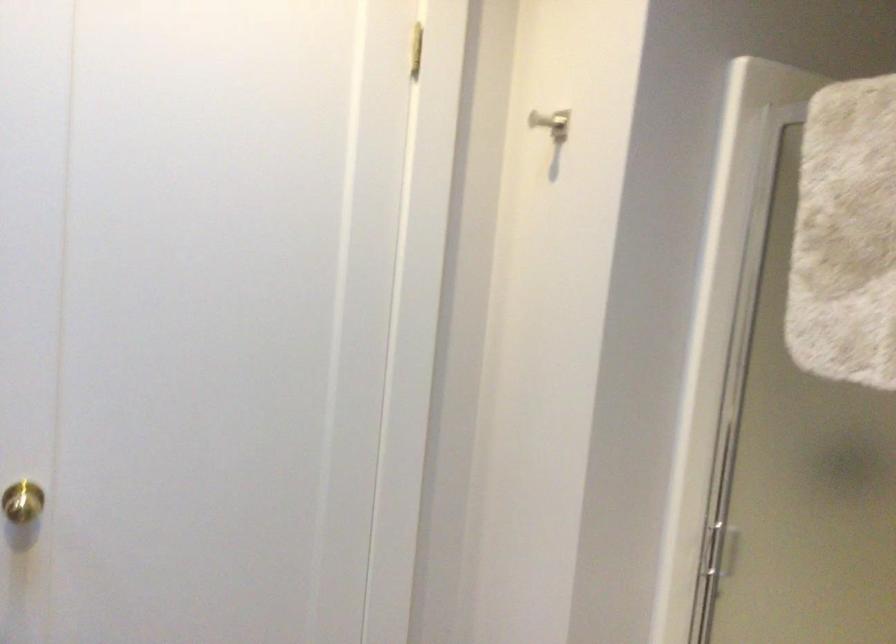
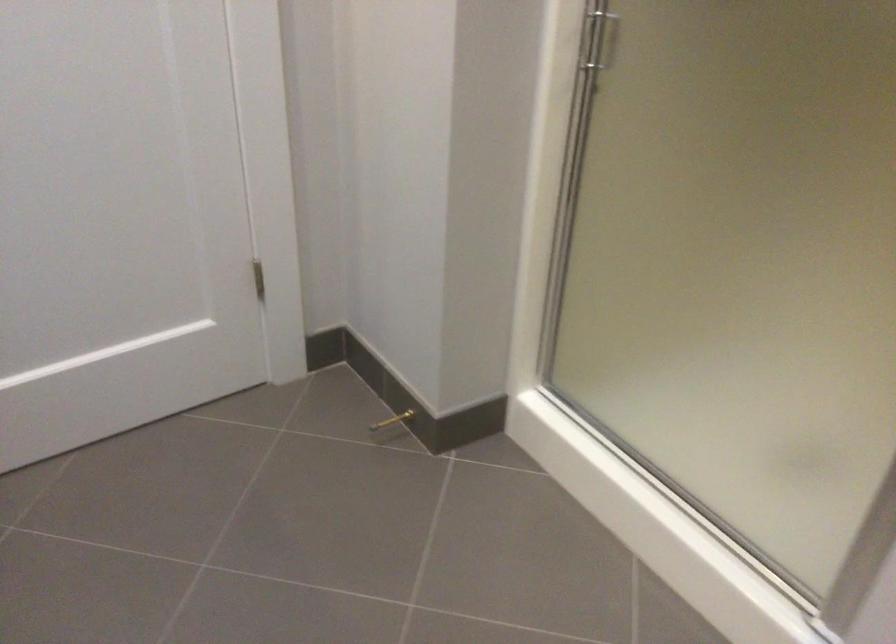
Where in the second image is the point corresponding to point (718, 542) from the first image?

(596, 39)